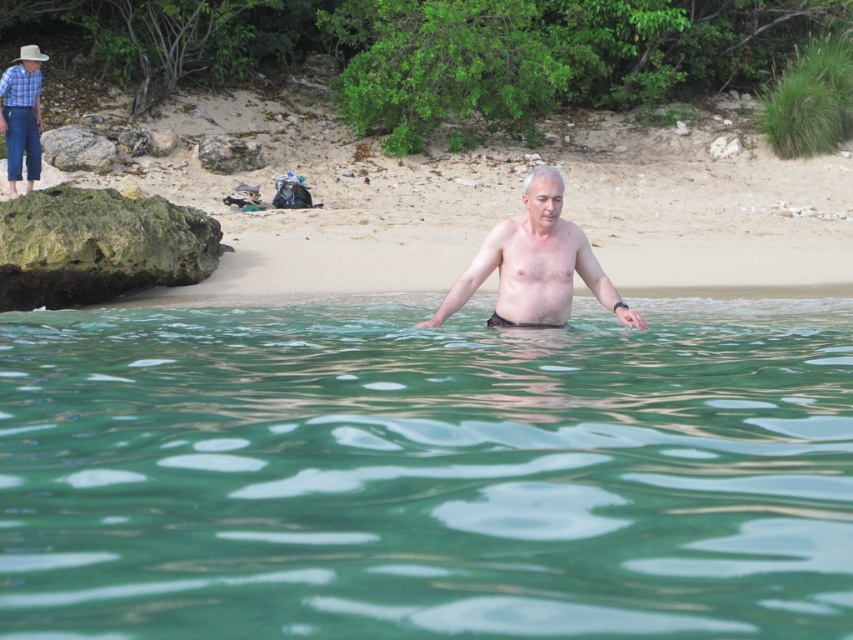
Consider the image. You are a photographer trying to capture a photo of both the sandy beach at center and the checkered fabric shirt at upper left in the same frame. Based on their distance, can you estimate if they will both fit within the camera view without moving the camera?

Answer: The sandy beach at center and checkered fabric shirt at upper left are 5.27 meters apart from each other. Depending on the camera lens and zoom settings, it is possible they could fit in the same frame if the camera has a wide enough angle or the photographer is positioned far enough back to encompass both objects within the 5.27 meter separation.

You are a photographer trying to capture a landscape shot of the sandy beach at center and the checkered fabric shirt at upper left. Which object should you focus on first if you want to ensure both are in sharp focus?

The sandy beach at center should be focused on first because it has a greater height compared to the checkered fabric shirt at upper left, allowing for better depth of field coverage.